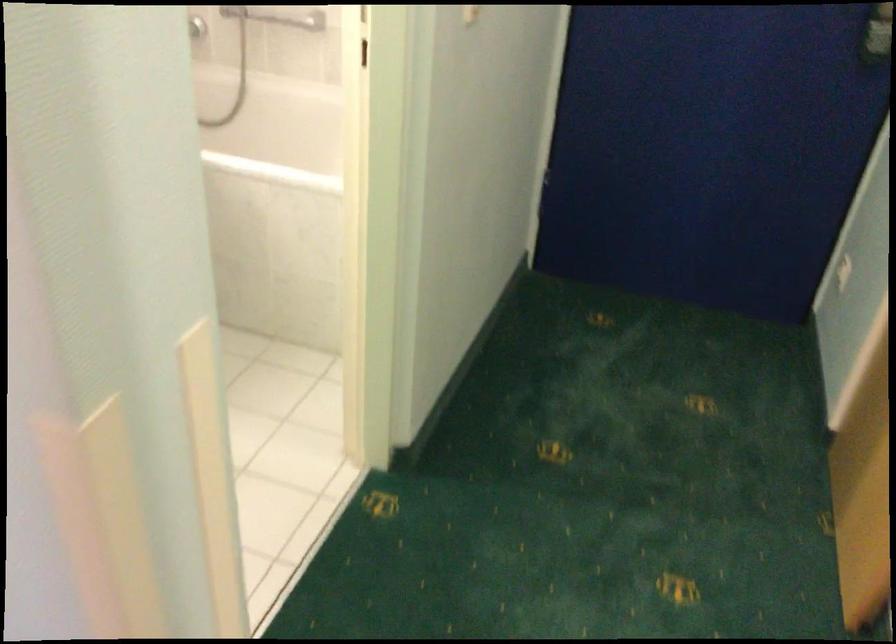
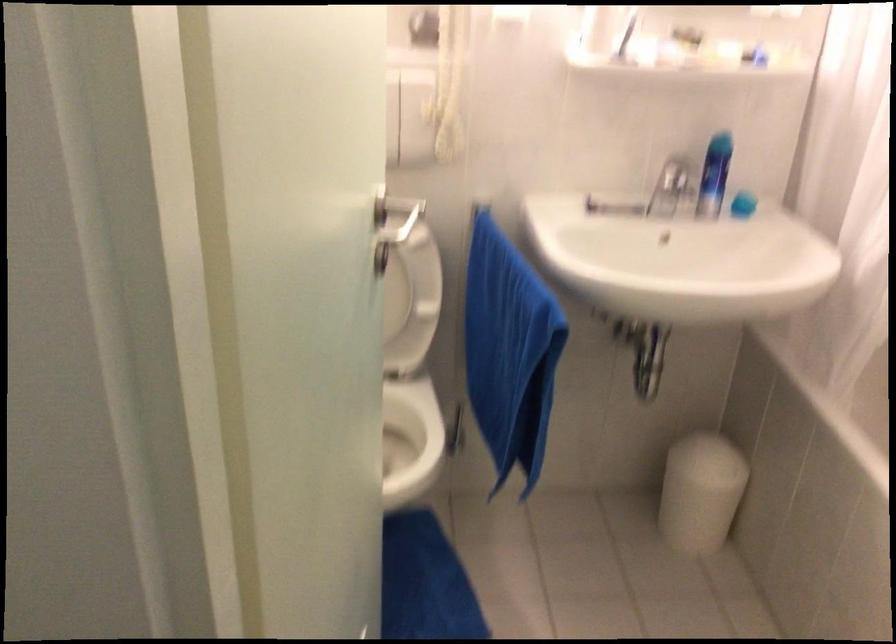
Question: How did the camera likely rotate?

Choices:
 (A) Left
 (B) Right
 (C) Up
 (D) Down

Answer: (A)